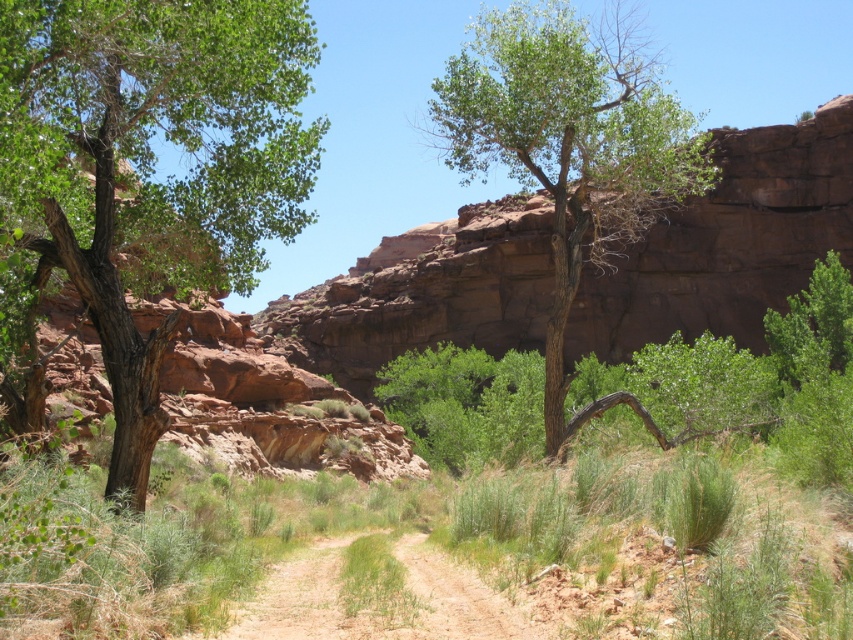
You are standing at the point marked as point (152, 164) in the image. Which direction should you walk to reach the green leafy tree at left?

The point (152, 164) is already at the green leafy tree at left, so you are already there.

You are standing on the brown sandy dirt track at center and want to walk towards the green leafy tree at left. Which direction should you go?

The green leafy tree at left is further to the viewer than the brown sandy dirt track at center, so you should walk forward towards it.

You are a hiker trying to navigate through the dirt path between the two green leafy trees. Which tree has a narrower trunk, the green leafy tree at left or the green leafy tree at center?

The green leafy tree at left has a lesser width compared to the green leafy tree at center, so the green leafy tree at left has a narrower trunk.